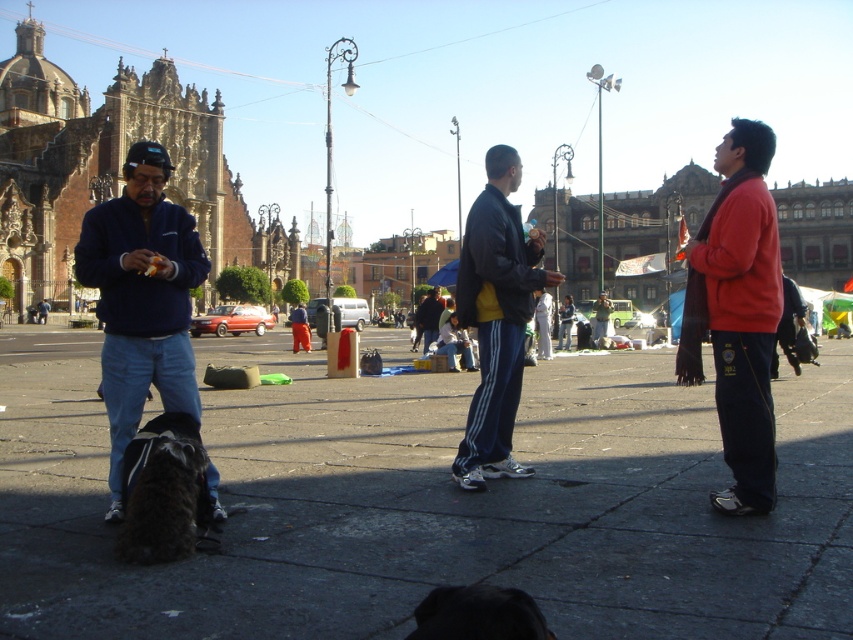
You are standing in the plaza and want to walk to the closest point between point A at point (741, 358) and point B at point (543, 276). Which point should you head towards?

Point A at point (741, 358) is closer to the viewer than point B at point (543, 276), so you should head towards point A at point (741, 358).